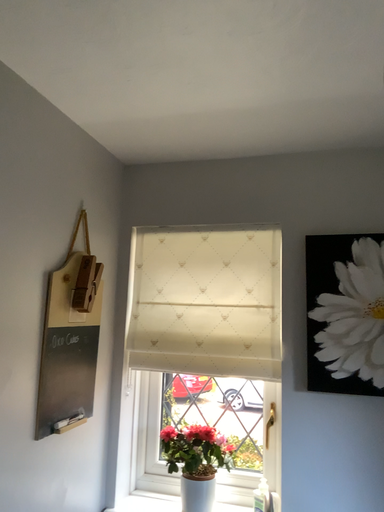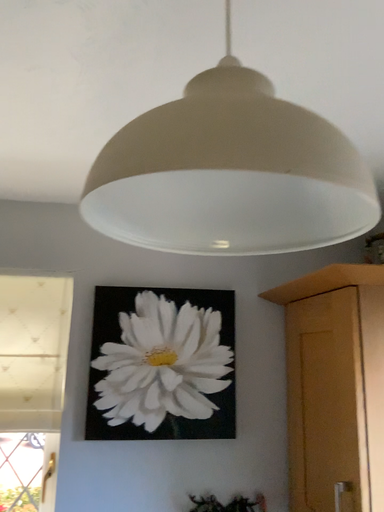
Question: Which way did the camera rotate in the video?

Choices:
 (A) rotated right
 (B) rotated left

Answer: (A)